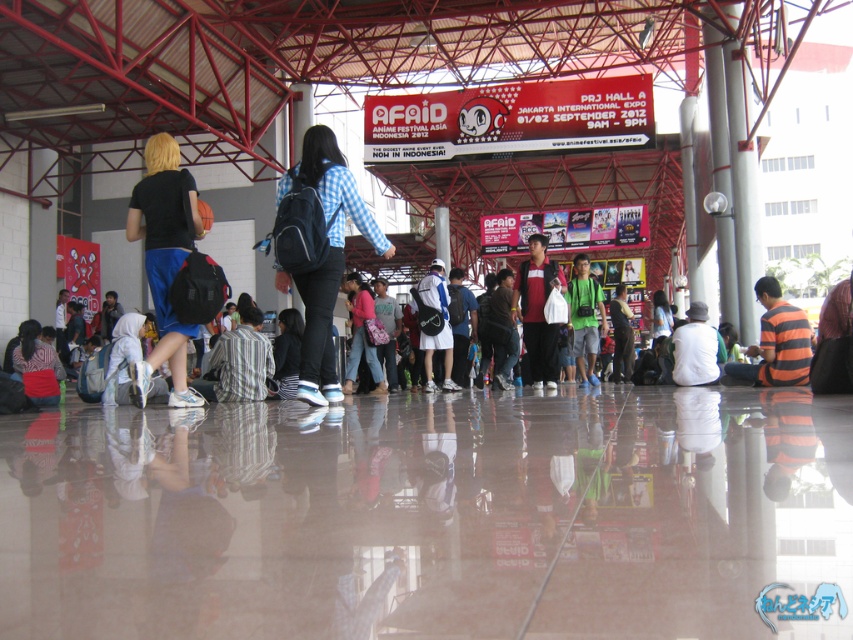
Question: Among these points, which one is nearest to the camera?

Choices:
 (A) (434, 291)
 (B) (683, 365)

Answer: (B)

Question: Does striped fabric shirt at center have a lesser width compared to white fabric backpack at center?

Choices:
 (A) no
 (B) yes

Answer: (B)

Question: Among these points, which one is farthest from the camera?

Choices:
 (A) (218, 349)
 (B) (631, 372)
 (C) (390, 301)
 (D) (123, 396)

Answer: (B)

Question: Which of these objects is positioned farthest from the black matte backpack at left?

Choices:
 (A) white fabric at lower left
 (B) checkered fabric shirt at center
 (C) red fabric bag at lower left
 (D) dark green backpack at center

Answer: (D)

Question: From the image, what is the correct spatial relationship of black matte backpack at left in relation to matte black backpack at center?

Choices:
 (A) right
 (B) left

Answer: (B)

Question: Considering the relative positions of black matte backpack at left and white cotton shirt at center in the image provided, where is black matte backpack at left located with respect to white cotton shirt at center?

Choices:
 (A) left
 (B) right

Answer: (A)